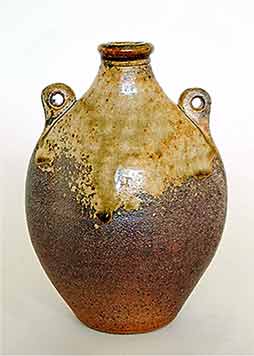
I want to click on brown area of vase, so click(x=169, y=242).